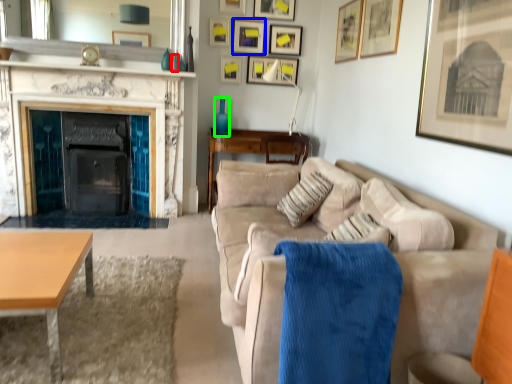
Question: Based on their relative distances, which object is nearer to vase (highlighted by a red box)? Choose from picture frame (highlighted by a blue box) and vase (highlighted by a green box).

Choices:
 (A) picture frame
 (B) vase

Answer: (B)